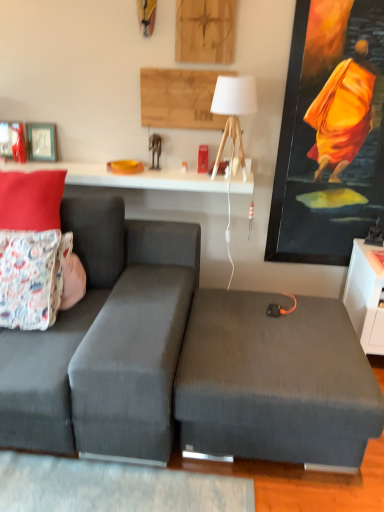
The height and width of the screenshot is (512, 384). What do you see at coordinates (105, 341) in the screenshot? I see `dark gray fabric couch at left` at bounding box center [105, 341].

At what (x,y) coordinates should I click in order to perform the action: click on matte fabric pillow at upper left, the 1th pillow when ordered from top to bottom. Please return your answer as a coordinate pair (x, y). The height and width of the screenshot is (512, 384). Looking at the image, I should click on (31, 199).

Where is `dark gray fabric ottoman at center`? The height and width of the screenshot is (512, 384). dark gray fabric ottoman at center is located at coordinates (275, 381).

What do you see at coordinates (42, 141) in the screenshot? I see `matte black picture frame at upper left, the 2th picture frame when ordered from left to right` at bounding box center [42, 141].

Describe the element at coordinates (233, 104) in the screenshot. I see `white matte table lamp at upper center` at that location.

This screenshot has width=384, height=512. I want to click on dark gray fabric couch at left, so click(105, 341).

Consider the image. Considering the sizes of matte black picture frame at upper left, the 1th picture frame from the right, and dark gray fabric ottoman at center in the image, is matte black picture frame at upper left, the 1th picture frame from the right, wider or thinner than dark gray fabric ottoman at center?

matte black picture frame at upper left, the 1th picture frame from the right, is thinner than dark gray fabric ottoman at center.

Who is shorter, matte black picture frame at upper left, the 2th picture frame when ordered from left to right, or dark gray fabric ottoman at center?

matte black picture frame at upper left, the 2th picture frame when ordered from left to right, is shorter.

Is matte black picture frame at upper left, the 1th picture frame from the right, not inside dark gray fabric ottoman at center?

Yes, matte black picture frame at upper left, the 1th picture frame from the right, is outside of dark gray fabric ottoman at center.

Is matte black picture frame at upper left, which is the second picture frame in right-to-left order, aimed at matte black picture frame at upper left, the 1th picture frame from the right?

No, matte black picture frame at upper left, which is the second picture frame in right-to-left order, is not oriented towards matte black picture frame at upper left, the 1th picture frame from the right.

You are a GUI agent. You are given a task and a screenshot of the screen. Output one action in this format:
    pyautogui.click(x=<x>, y=<y>)
    Task: Click on the picture frame below the matte black picture frame at upper left, which is the second picture frame in right-to-left order (from a real-world perspective)
    The image size is (384, 512).
    Given the screenshot: What is the action you would take?
    pyautogui.click(x=42, y=141)

In terms of height, does matte black picture frame at upper left, which is the second picture frame in right-to-left order, look taller or shorter compared to matte black picture frame at upper left, the 2th picture frame when ordered from left to right?

Clearly, matte black picture frame at upper left, which is the second picture frame in right-to-left order, is shorter compared to matte black picture frame at upper left, the 2th picture frame when ordered from left to right.

From the image's perspective, relative to matte black picture frame at upper left, the 1th picture frame from the right, is matte black picture frame at upper left, which is the second picture frame in right-to-left order, above or below?

Clearly, from the image's perspective, matte black picture frame at upper left, which is the second picture frame in right-to-left order, is above matte black picture frame at upper left, the 1th picture frame from the right.

From the picture: Which of these two, matte black picture frame at upper left, which is the second picture frame in right-to-left order, or dark gray fabric ottoman at center, is smaller?

matte black picture frame at upper left, which is the second picture frame in right-to-left order.

From a real-world perspective, is matte black picture frame at upper left, which is the second picture frame in right-to-left order, over dark gray fabric ottoman at center?

Yes, from a real-world perspective, matte black picture frame at upper left, which is the second picture frame in right-to-left order, is above dark gray fabric ottoman at center.

Locate an element on the screen. Image resolution: width=384 pixels, height=512 pixels. the 2nd picture frame located above the dark gray fabric ottoman at center (from a real-world perspective) is located at coordinates (10, 137).

Is floral fabric pillow at left, the second pillow in the top-to-bottom sequence, wider than white matte table lamp at upper center?

Yes, floral fabric pillow at left, the second pillow in the top-to-bottom sequence, is wider than white matte table lamp at upper center.

Can you confirm if floral fabric pillow at left, the second pillow in the top-to-bottom sequence, is smaller than white matte table lamp at upper center?

Incorrect, floral fabric pillow at left, the second pillow in the top-to-bottom sequence, is not smaller in size than white matte table lamp at upper center.

Who is shorter, floral fabric pillow at left, which is the 1th pillow from bottom to top, or white matte table lamp at upper center?

white matte table lamp at upper center.

Is floral fabric pillow at left, the second pillow in the top-to-bottom sequence, oriented away from dark gray fabric ottoman at center?

floral fabric pillow at left, the second pillow in the top-to-bottom sequence, is not turned away from dark gray fabric ottoman at center.

Based on the photo, is floral fabric pillow at left, which is the 1th pillow from bottom to top, beside dark gray fabric ottoman at center?

No, floral fabric pillow at left, which is the 1th pillow from bottom to top, is not making contact with dark gray fabric ottoman at center.

From a real-world perspective, who is located higher, floral fabric pillow at left, which is the 1th pillow from bottom to top, or dark gray fabric ottoman at center?

From a 3D spatial view, floral fabric pillow at left, which is the 1th pillow from bottom to top, is above.

Visually, is floral fabric pillow at left, which is the 1th pillow from bottom to top, positioned to the left or to the right of dark gray fabric couch at left?

Based on their positions, floral fabric pillow at left, which is the 1th pillow from bottom to top, is located to the left of dark gray fabric couch at left.

From their relative heights in the image, would you say floral fabric pillow at left, which is the 1th pillow from bottom to top, is taller or shorter than dark gray fabric couch at left?

In the image, floral fabric pillow at left, which is the 1th pillow from bottom to top, appears to be shorter than dark gray fabric couch at left.

How distant is floral fabric pillow at left, the second pillow in the top-to-bottom sequence, from dark gray fabric couch at left?

11.07 inches.

Is floral fabric pillow at left, which is the 1th pillow from bottom to top, in front of or behind dark gray fabric couch at left in the image?

floral fabric pillow at left, which is the 1th pillow from bottom to top, is positioned farther from the viewer than dark gray fabric couch at left.

Is white glossy table at upper center next to matte black picture frame at upper left, which is the second picture frame in right-to-left order, and touching it?

No.

Which object is wider, white glossy table at upper center or matte black picture frame at upper left, which is the second picture frame in right-to-left order?

white glossy table at upper center.

From the image's perspective, between white glossy table at upper center and matte black picture frame at upper left, which ranks as the 1th picture frame in left-to-right order, who is located below?

white glossy table at upper center.

Find the location of `swivel chair below the matte black picture frame at upper left, the 2th picture frame when ordered from left to right (from the image's perspective)`. swivel chair below the matte black picture frame at upper left, the 2th picture frame when ordered from left to right (from the image's perspective) is located at coordinates (275, 381).

The width and height of the screenshot is (384, 512). In order to click on picture frame below the matte black picture frame at upper left, which is the second picture frame in right-to-left order (from a real-world perspective) in this screenshot , I will do `click(42, 141)`.

Based on their spatial positions, is dark gray fabric ottoman at center or white glossy table at upper center further from dark gray fabric couch at left?

white glossy table at upper center is further to dark gray fabric couch at left.

Which object lies further to the anchor point floral fabric pillow at left, which is the 1th pillow from bottom to top, matte black picture frame at upper left, the 2th picture frame when ordered from left to right, or white glossy table at upper center?

The object further to floral fabric pillow at left, which is the 1th pillow from bottom to top, is matte black picture frame at upper left, the 2th picture frame when ordered from left to right.

When comparing their distances from matte black picture frame at upper left, the 1th picture frame from the right, does white glossy table at upper center or matte fabric pillow at upper left, the 1th pillow when ordered from top to bottom, seem further?

matte fabric pillow at upper left, the 1th pillow when ordered from top to bottom, lies further to matte black picture frame at upper left, the 1th picture frame from the right, than the other object.

Considering their positions, is matte fabric pillow at upper left, the 1th pillow when ordered from top to bottom, positioned closer to dark gray fabric ottoman at center than matte black picture frame at upper left, the 1th picture frame from the right?

Based on the image, matte fabric pillow at upper left, the 1th pillow when ordered from top to bottom, appears to be nearer to dark gray fabric ottoman at center.

Based on their spatial positions, is matte black picture frame at upper left, which ranks as the 1th picture frame in left-to-right order, or white glossy table at upper center further from dark gray fabric couch at left?

matte black picture frame at upper left, which ranks as the 1th picture frame in left-to-right order.

Based on their spatial positions, is matte black picture frame at upper left, the 2th picture frame when ordered from left to right, or dark gray fabric ottoman at center further from floral fabric pillow at left, the second pillow in the top-to-bottom sequence?

matte black picture frame at upper left, the 2th picture frame when ordered from left to right, is further to floral fabric pillow at left, the second pillow in the top-to-bottom sequence.

From the image, which object appears to be farther from dark gray fabric ottoman at center, dark gray fabric couch at left or matte fabric pillow at upper left, the 1th pillow when ordered from top to bottom?

matte fabric pillow at upper left, the 1th pillow when ordered from top to bottom, is positioned further to the anchor dark gray fabric ottoman at center.

Consider the image. Which object lies further to the anchor point white matte table lamp at upper center, floral fabric pillow at left, the second pillow in the top-to-bottom sequence, or white glossy table at upper center?

floral fabric pillow at left, the second pillow in the top-to-bottom sequence, is positioned further to the anchor white matte table lamp at upper center.

Locate an element on the screen. This screenshot has width=384, height=512. table between dark gray fabric couch at left and matte black picture frame at upper left, which is the second picture frame in right-to-left order, in the front-back direction is located at coordinates (128, 177).

Identify the location of pillow positioned between dark gray fabric couch at left and matte fabric pillow at upper left, positioned as the 2th pillow in bottom-to-top order, from near to far. (32, 277).

I want to click on picture frame between matte fabric pillow at upper left, the 1th pillow when ordered from top to bottom, and matte black picture frame at upper left, which is the second picture frame in right-to-left order, in the front-back direction, so point(42,141).

This screenshot has width=384, height=512. I want to click on couch between matte fabric pillow at upper left, the 1th pillow when ordered from top to bottom, and white matte table lamp at upper center from left to right, so [x=105, y=341].